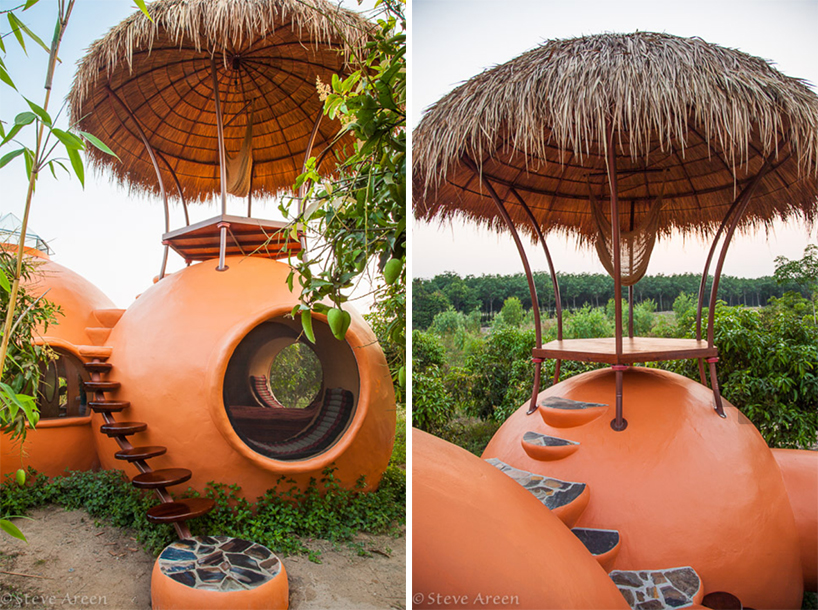
At what (x,y) coordinates should I click in order to perform the action: click on glossy brown stairs. Please return your answer as a coordinate pair (x, y). Looking at the image, I should click on (185, 510), (169, 486), (150, 456), (135, 420), (115, 412), (109, 388), (100, 366).